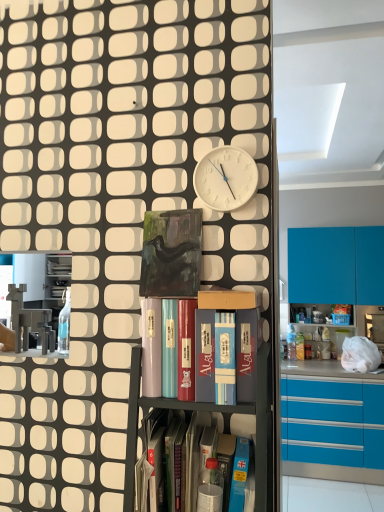
Question: Is metallic gray bookshelf at center, which ranks as the second shelf in left-to-right order, bigger or smaller than blue glossy cupboard at center?

Choices:
 (A) small
 (B) big

Answer: (B)

Question: Is metallic gray bookshelf at center, which is counted as the 3th shelf, starting from the right, spatially inside blue glossy cupboard at center, or outside of it?

Choices:
 (A) inside
 (B) outside

Answer: (B)

Question: Which object is positioned farthest from the matte cardboard box at center, placed as the second shelf when sorted from right to left?

Choices:
 (A) metallic gray bookshelf at center, placed as the 1th shelf when sorted from right to left
 (B) blue glossy cupboard at center
 (C) white matte clock at upper center
 (D) metallic gray shelf at left, which is the 1th shelf in left-to-right order
 (E) green glass book at center

Answer: (D)

Question: Estimate the real-world distances between objects in this image. Which object is farther from the metallic gray bookshelf at center, which ranks as the second shelf in left-to-right order?

Choices:
 (A) white matte clock at upper center
 (B) metallic gray shelf at left, placed as the fourth shelf when sorted from right to left
 (C) matte cardboard box at center, which is the third shelf in left-to-right order
 (D) green glass book at center
 (E) blue glossy cupboard at center

Answer: (B)